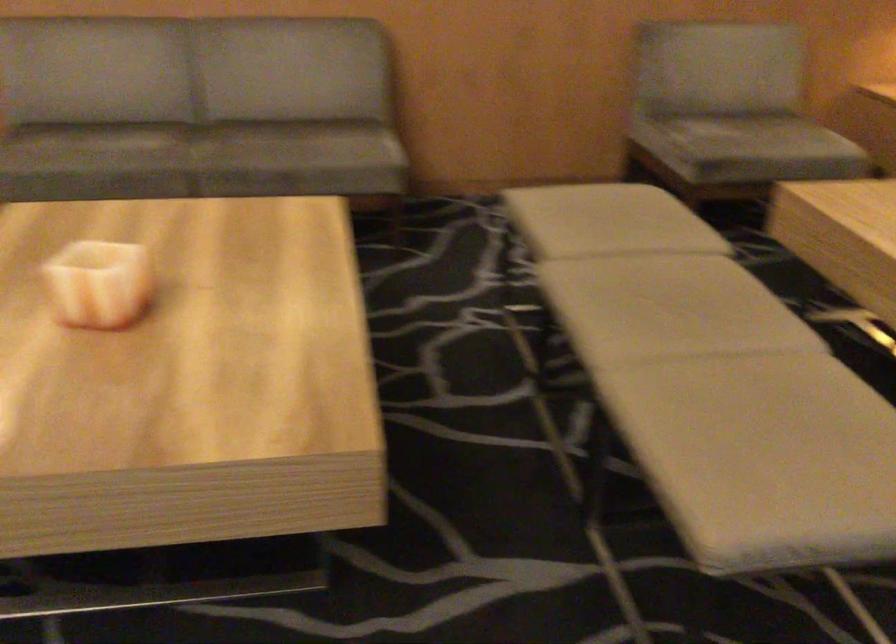
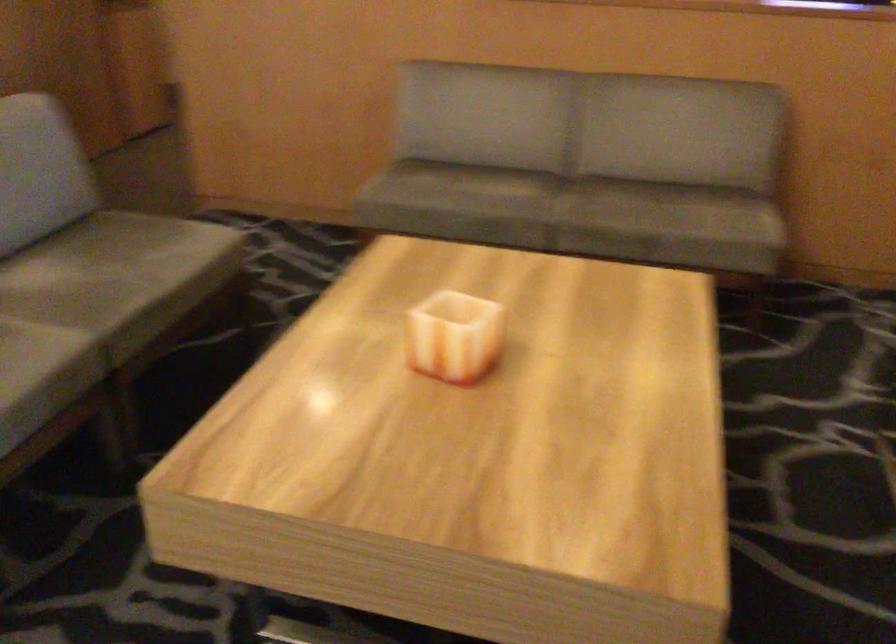
In a continuous first-person perspective shot, in which direction is the camera moving?

The cameraman moved toward left, forward.